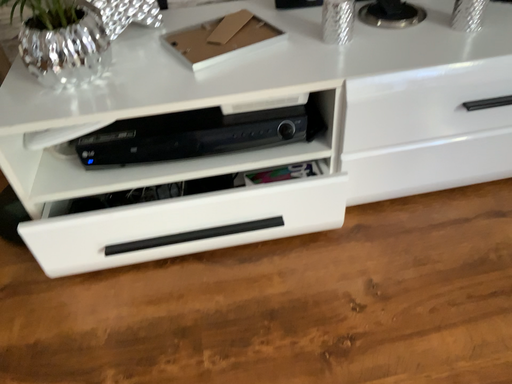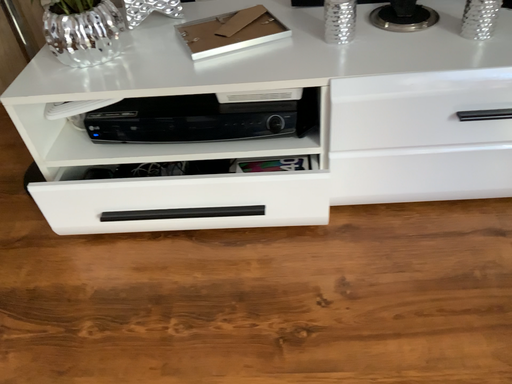
Question: How did the camera likely rotate when shooting the video?

Choices:
 (A) rotated left
 (B) rotated right

Answer: (A)